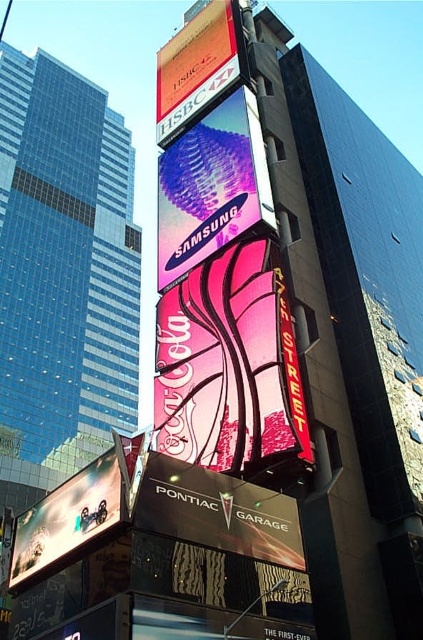
Who is taller, metallic pink samsung at center or metallic silver billboard at lower left?

Standing taller between the two is metallic pink samsung at center.

Measure the distance between metallic pink samsung at center and metallic silver billboard at lower left.

20.33 meters

The height and width of the screenshot is (640, 423). What do you see at coordinates (211, 186) in the screenshot?
I see `metallic pink samsung at center` at bounding box center [211, 186].

I want to click on metallic pink samsung at center, so pos(211,186).

Is pink glossy coca-cola sign at center closer to the viewer compared to metallic silver billboard at lower left?

No, pink glossy coca-cola sign at center is further to the viewer.

Identify the location of pink glossy coca-cola sign at center. The width and height of the screenshot is (423, 640). (228, 364).

Is point (198, 349) positioned behind point (85, 476)?

Yes.

This screenshot has height=640, width=423. I want to click on pink glossy coca-cola sign at center, so 228,364.

Between orange glossy billboard at upper center and metallic silver billboard at lower left, which one appears on the right side from the viewer's perspective?

Positioned to the right is orange glossy billboard at upper center.

Which of these two, orange glossy billboard at upper center or metallic silver billboard at lower left, stands taller?

orange glossy billboard at upper center is taller.

The width and height of the screenshot is (423, 640). What do you see at coordinates (195, 67) in the screenshot?
I see `orange glossy billboard at upper center` at bounding box center [195, 67].

Locate an element on the screen. This screenshot has width=423, height=640. orange glossy billboard at upper center is located at coordinates (195, 67).